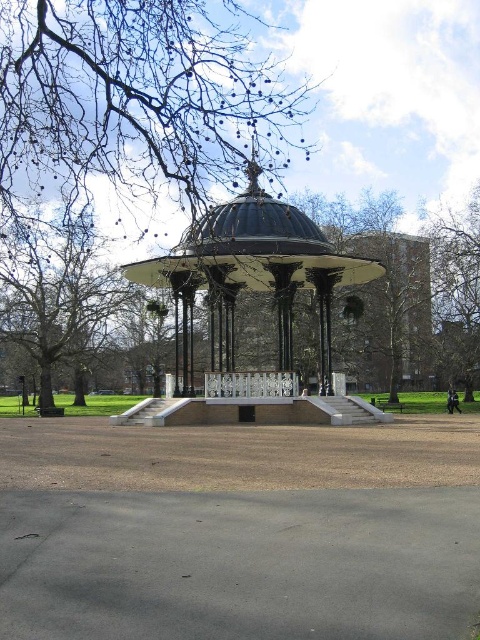
Question: Can you confirm if smooth bark tree at upper center is smaller than black metal gazebo at center?

Choices:
 (A) yes
 (B) no

Answer: (B)

Question: Which object is positioned closest to the black metal gazebo at center?

Choices:
 (A) wooden park bench at lower right
 (B) smooth bark tree at right
 (C) smooth bark tree at upper center
 (D) brown leafy tree at left

Answer: (C)

Question: Which point is closer to the camera taking this photo?

Choices:
 (A) (188, 36)
 (B) (392, 408)
 (C) (265, 243)
 (D) (60, 264)

Answer: (A)

Question: Observing the image, what is the correct spatial positioning of smooth bark tree at right in reference to wooden park bench at lower right?

Choices:
 (A) left
 (B) right

Answer: (B)

Question: Which object is positioned closest to the smooth bark tree at upper center?

Choices:
 (A) brown leafy tree at left
 (B) wooden park bench at lower right
 (C) black metal gazebo at center
 (D) smooth bark tree at right

Answer: (C)

Question: Does black metal gazebo at center appear on the right side of wooden park bench at lower right?

Choices:
 (A) no
 (B) yes

Answer: (A)